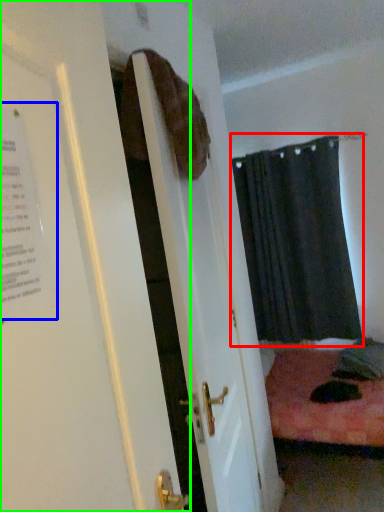
Question: Which object is the closest to the curtain (highlighted by a red box)? Choose among these: poster (highlighted by a blue box) or door (highlighted by a green box).

Choices:
 (A) poster
 (B) door

Answer: (B)